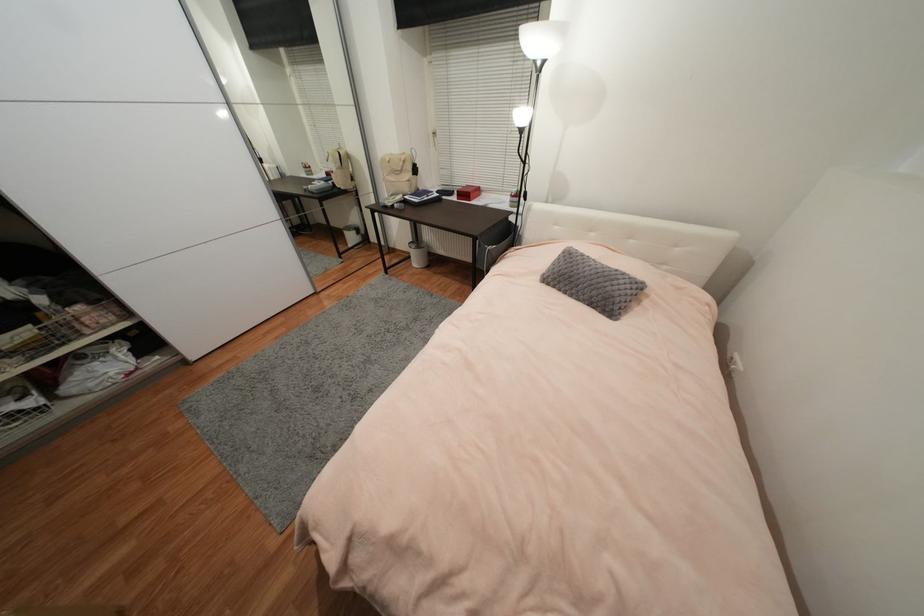
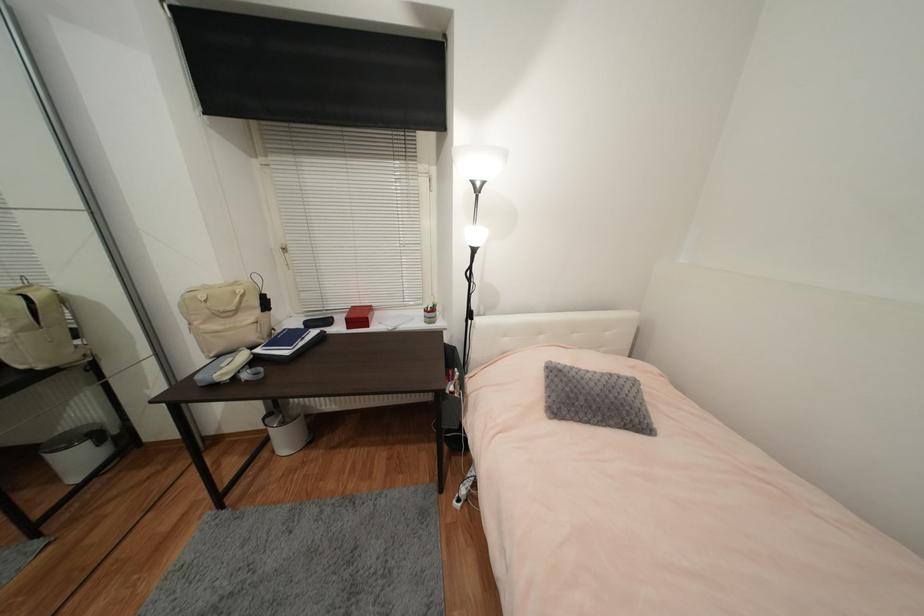
Where in the second image is the point corresponding to the point at 357,240 from the first image?

(83, 462)